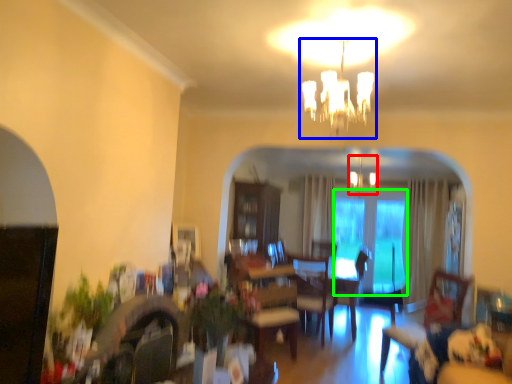
Question: Considering the real-world distances, which object is farthest from fixture (highlighted by a red box)? light fixture (highlighted by a blue box) or glass door (highlighted by a green box)?

Choices:
 (A) light fixture
 (B) glass door

Answer: (A)